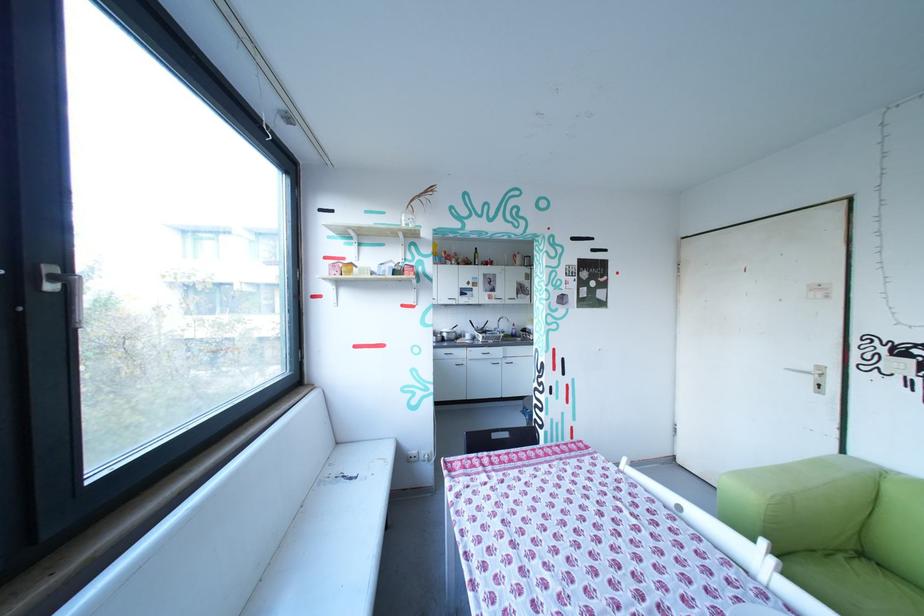
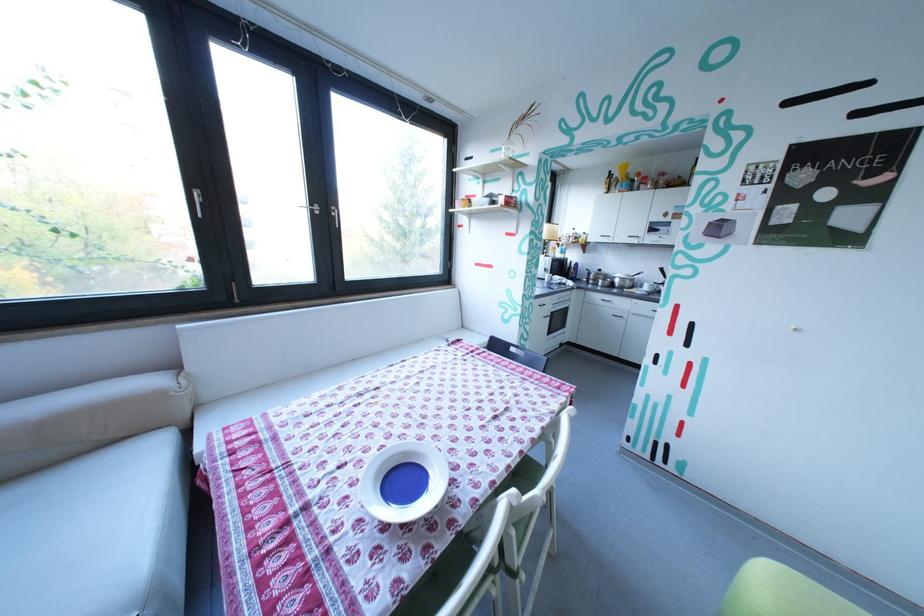
Locate, in the second image, the point that corresponds to the point at 457,334 in the first image.

(629, 281)